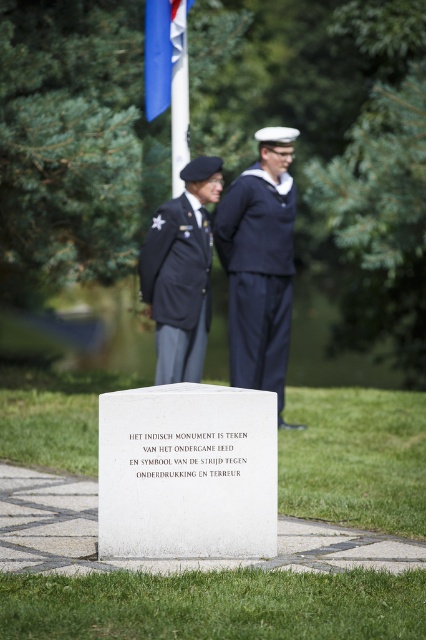
Does dark blue fabric uniform at center have a greater height compared to blue fabric flag at upper center?

Yes, dark blue fabric uniform at center is taller than blue fabric flag at upper center.

Who is higher up, dark blue fabric uniform at center or blue fabric flag at upper center?

Positioned higher is blue fabric flag at upper center.

Does point (169, 269) come closer to viewer compared to point (155, 115)?

That is True.

Find the location of a particular element. The width and height of the screenshot is (426, 640). dark blue fabric uniform at center is located at coordinates (178, 288).

Which is above, navy blue fabric sailor suit at center or dark blue fabric uniform at center?

navy blue fabric sailor suit at center is higher up.

The height and width of the screenshot is (640, 426). What do you see at coordinates (256, 278) in the screenshot? I see `navy blue fabric sailor suit at center` at bounding box center [256, 278].

Identify the location of navy blue fabric sailor suit at center. The height and width of the screenshot is (640, 426). (256, 278).

Is navy blue fabric sailor suit at center taller than blue fabric flag at upper center?

Correct, navy blue fabric sailor suit at center is much taller as blue fabric flag at upper center.

Does point (267, 284) come closer to viewer compared to point (163, 90)?

Yes, it is.

Is point (267, 381) behind point (155, 22)?

No, (267, 381) is in front of (155, 22).

Find the location of a particular element. This screenshot has width=426, height=640. navy blue fabric sailor suit at center is located at coordinates (256, 278).